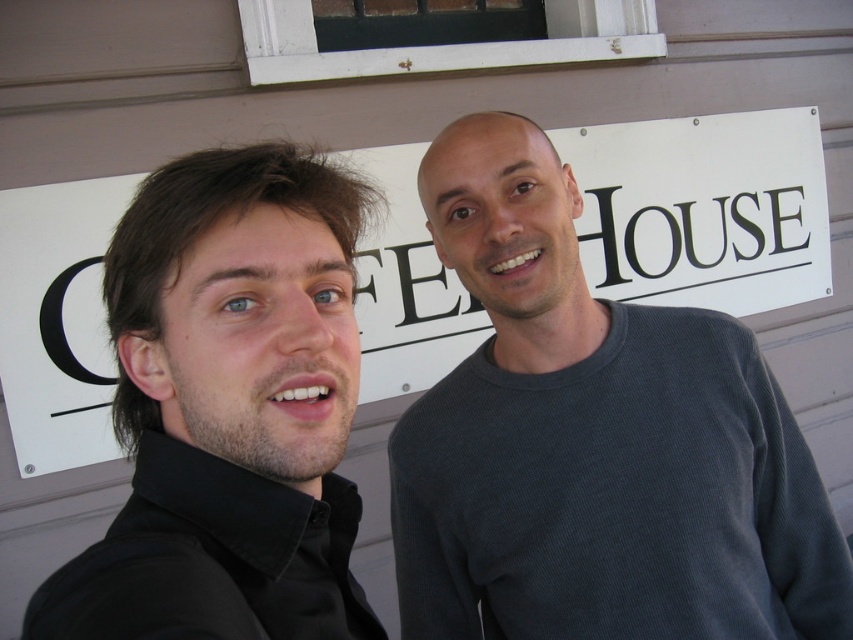
Measure the distance between gray ribbed sweater at center and camera.

gray ribbed sweater at center and camera are 3.44 feet apart.

Which is in front, point (426, 627) or point (143, 557)?

Point (143, 557) is in front.

Find the location of `gray ribbed sweater at center`. gray ribbed sweater at center is located at coordinates (595, 442).

Between point (491, 188) and point (38, 275), which one is positioned behind?

The point (38, 275) is behind.

Can you confirm if gray ribbed sweater at center is positioned to the right of white paper sign at center?

Incorrect, gray ribbed sweater at center is not on the right side of white paper sign at center.

Does point (492, 342) come in front of point (412, 376)?

That is True.

Image resolution: width=853 pixels, height=640 pixels. In order to click on gray ribbed sweater at center in this screenshot , I will do `click(595, 442)`.

Can you confirm if black matte shirt at left is wider than white paper sign at center?

In fact, black matte shirt at left might be narrower than white paper sign at center.

Which is behind, point (151, 328) or point (654, 198)?

The point (654, 198) is more distant.

Identify the location of black matte shirt at left. This screenshot has width=853, height=640. (228, 410).